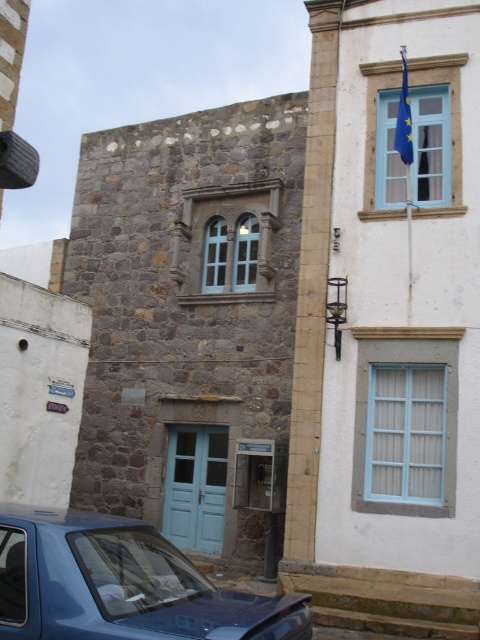
Is point (157, 595) positioned after point (409, 163)?

No, (157, 595) is closer to viewer.

Between point (181, 616) and point (398, 109), which one is positioned in front?

Point (181, 616) is in front.

Which is behind, point (34, 548) or point (408, 104)?

The point (408, 104) is behind.

This screenshot has height=640, width=480. I want to click on metallic blue car at lower left, so click(x=120, y=584).